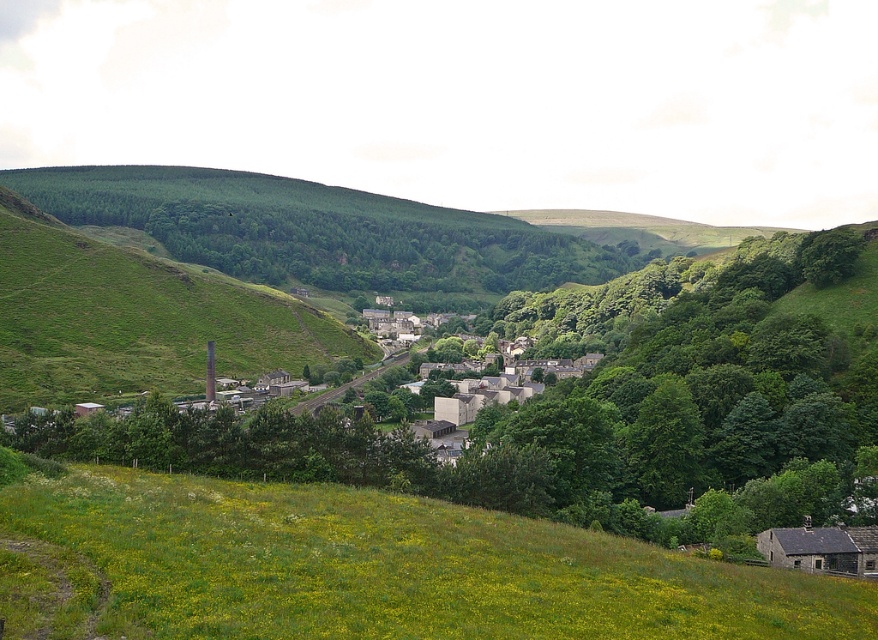
Question: Among these points, which one is nearest to the camera?

Choices:
 (A) (x=6, y=515)
 (B) (x=12, y=288)

Answer: (A)

Question: Is the position of green grassy hillside at lower center less distant than that of green grassy hillside at left?

Choices:
 (A) no
 (B) yes

Answer: (B)

Question: Which object is farther from the camera taking this photo?

Choices:
 (A) green grassy hillside at left
 (B) green grassy hillside at lower center

Answer: (A)

Question: Is green grassy hillside at lower center positioned behind green grassy hillside at left?

Choices:
 (A) yes
 (B) no

Answer: (B)

Question: Among these objects, which one is nearest to the camera?

Choices:
 (A) green grassy hillside at left
 (B) green grassy hillside at lower center

Answer: (B)

Question: Is the position of green grassy hillside at lower center less distant than that of green grassy hillside at left?

Choices:
 (A) yes
 (B) no

Answer: (A)